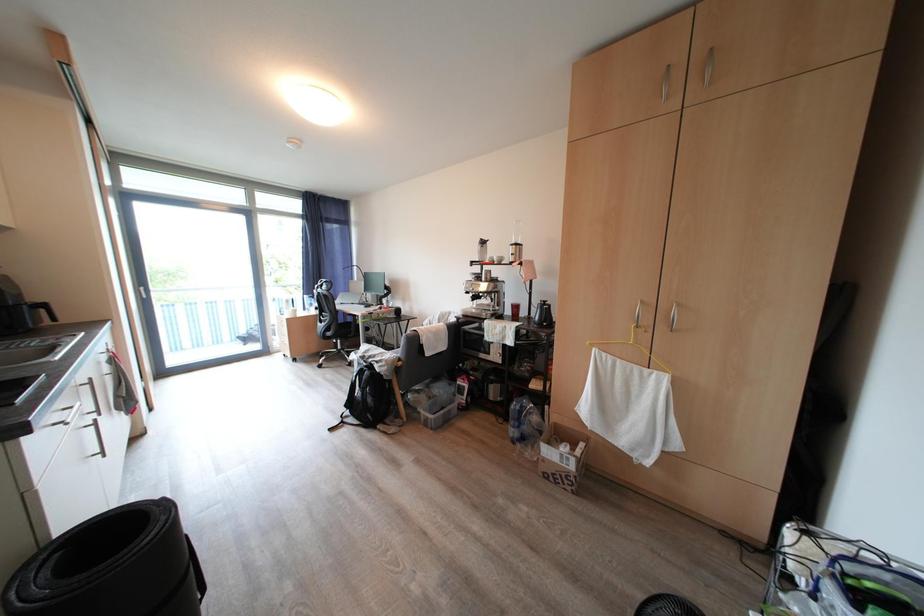
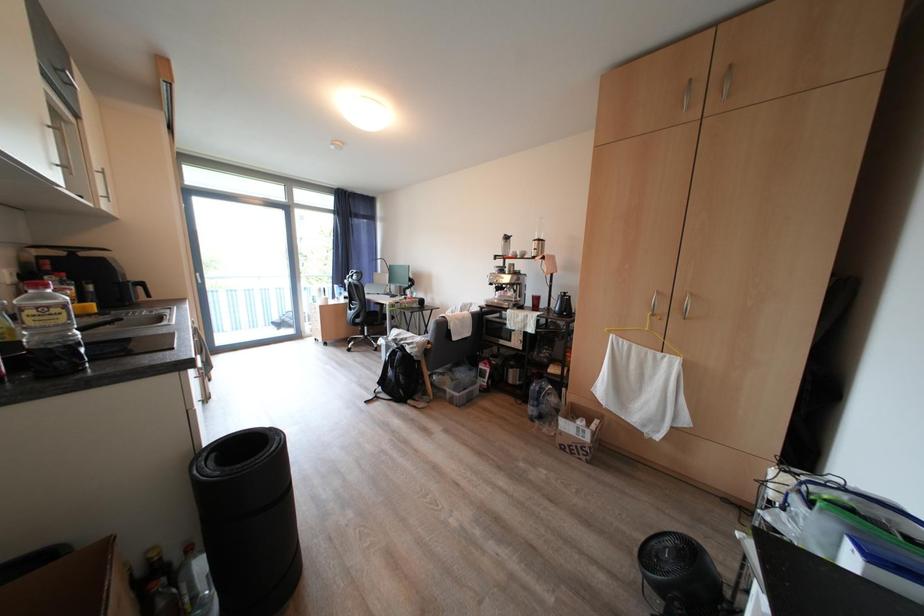
Question: The camera is either moving clockwise (left) or counter-clockwise (right) around the object. The first image is from the beginning of the video and the second image is from the end. Is the camera moving left or right when shooting the video?

Choices:
 (A) Left
 (B) Right

Answer: (B)